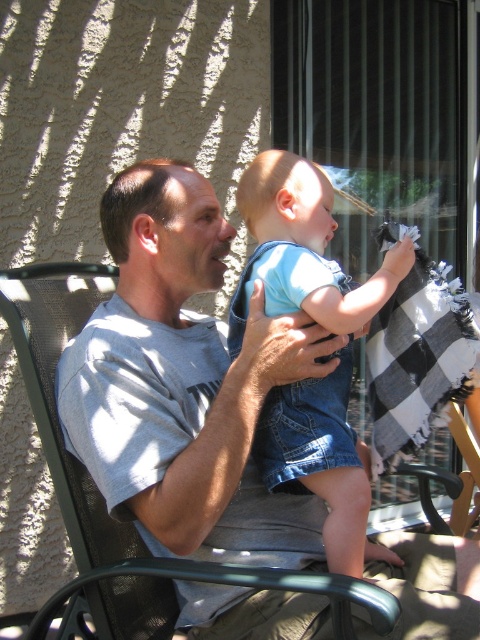
Question: Considering the relative positions of gray cotton t-shirt at center and light blue denim shorts at center in the image provided, where is gray cotton t-shirt at center located with respect to light blue denim shorts at center?

Choices:
 (A) above
 (B) below

Answer: (B)

Question: Considering the relative positions of gray cotton t-shirt at center and light blue denim shorts at center in the image provided, where is gray cotton t-shirt at center located with respect to light blue denim shorts at center?

Choices:
 (A) left
 (B) right

Answer: (A)

Question: Which point is closer to the camera?

Choices:
 (A) light blue denim shorts at center
 (B) gray cotton t-shirt at center

Answer: (B)

Question: Which point appears farthest from the camera in this image?

Choices:
 (A) (327, 410)
 (B) (117, 477)

Answer: (A)

Question: Which point is farther to the camera?

Choices:
 (A) (73, 356)
 (B) (288, 275)

Answer: (B)

Question: Does gray cotton t-shirt at center appear on the left side of light blue denim shorts at center?

Choices:
 (A) yes
 (B) no

Answer: (A)